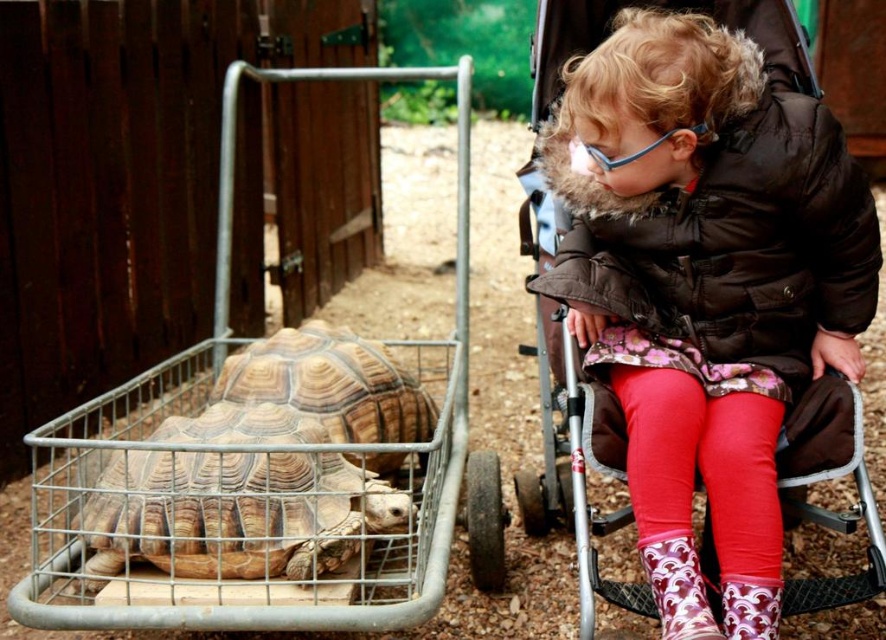
You are a photographer trying to capture a closeup of the tortoise in the cage. You notice the fluffy brown coat at upper right and the printed fabric boot at lower right are blocking your view. Which object is closer to the right side of your camera frame?

The fluffy brown coat at upper right is positioned on the right side of the printed fabric boot at lower right, so the fluffy brown coat at upper right is closer to the right side of the camera frame.

You are a photographer trying to capture a clear shot of the printed fabric boot at lower right without the fluffy brown coat at upper right blocking it. What adjustment should you make to your camera angle?

The fluffy brown coat at upper right is positioned over the printed fabric boot at lower right. To avoid blocking the boot, you should lower your camera angle to look underneath the coat.

You are a zookeeper who needs to ensure the tortoise is healthy. You have a measuring tool to check the size of the brown textured shell at center and the brown textured tortoise at left. Which one is wider?

The brown textured shell at center is wider than the brown textured tortoise at left according to the description.